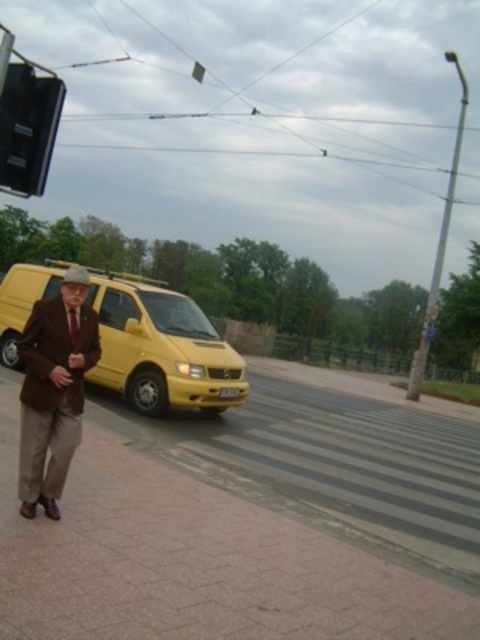
Question: Which point is closer to the camera?

Choices:
 (A) (49, 160)
 (B) (49, 378)

Answer: (B)

Question: Which of the following is the closest to the observer?

Choices:
 (A) (24, 296)
 (B) (41, 131)

Answer: (B)

Question: Does brown brick pavement at lower left lie in front of brown woolen suit at left?

Choices:
 (A) no
 (B) yes

Answer: (B)

Question: Can you confirm if yellow matte van at left is smaller than brown woolen suit at left?

Choices:
 (A) yes
 (B) no

Answer: (B)

Question: Which point is closer to the camera?

Choices:
 (A) (38, 369)
 (B) (57, 112)
 (C) (159, 324)
 (D) (267, 547)

Answer: (A)

Question: Does yellow matte van at left come in front of brown woolen suit at left?

Choices:
 (A) no
 (B) yes

Answer: (A)